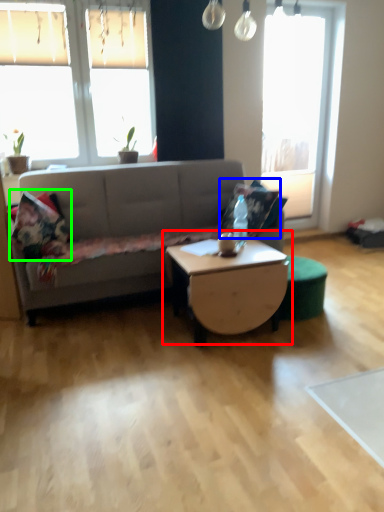
Question: Estimate the real-world distances between objects in this image. Which object is farther from coffee table (highlighted by a red box), pillow (highlighted by a blue box) or pillow (highlighted by a green box)?

Choices:
 (A) pillow
 (B) pillow

Answer: (B)